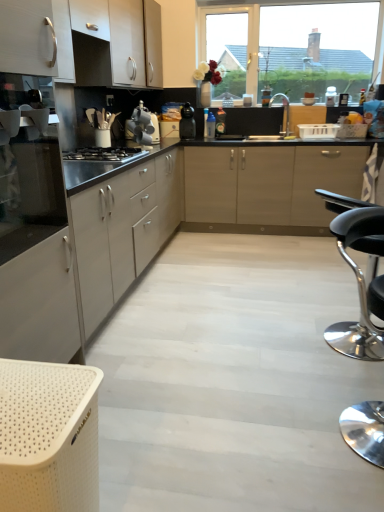
Question: Is black leather stool at lower right in front of or behind black matte coffee maker at center, the second kitchen appliance from the left, in the image?

Choices:
 (A) behind
 (B) front

Answer: (B)

Question: In terms of width, does black leather stool at lower right look wider or thinner when compared to black matte coffee maker at center, placed as the first kitchen appliance when sorted from back to front?

Choices:
 (A) wide
 (B) thin

Answer: (A)

Question: Based on their relative distances, which object is nearer to the white matte cabinet at left, the third cabinetry when ordered from top to bottom?

Choices:
 (A) black leather stool at lower right
 (B) white matte cabinet at upper left, which appears as the 2th cabinetry when viewed from the top
 (C) beige perforated basket at lower left
 (D) black matte coffee maker at center, the second kitchen appliance from the left
 (E) matte white cabinet at upper left, arranged as the first cabinetry when viewed from the top

Answer: (B)

Question: Based on their relative distances, which object is farther from the matte white cabinet at upper left, marked as the third cabinetry in a bottom-to-top arrangement?

Choices:
 (A) black leather stool at lower right
 (B) black matte gas stove at center
 (C) transparent glass window at upper center
 (D) satin silver kettle at center, the 2th kitchen appliance viewed from the right
 (E) white plastic toaster at center

Answer: (A)